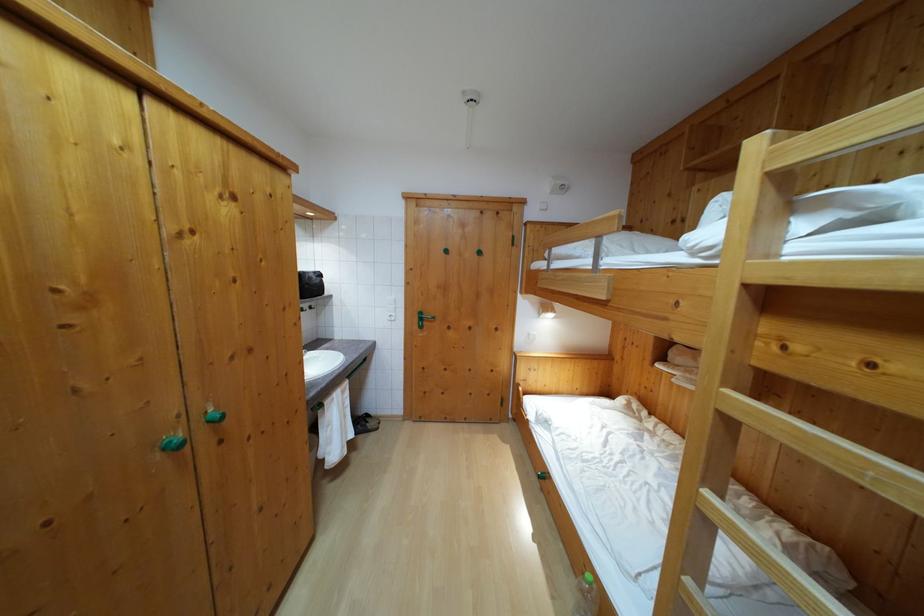
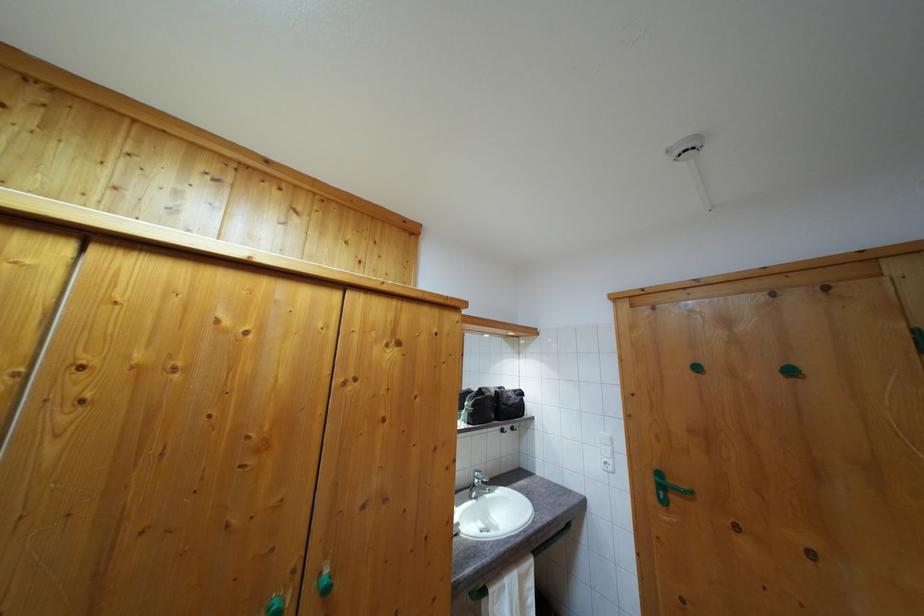
Find the pixel in the second image that matches (319,280) in the first image.

(518, 398)